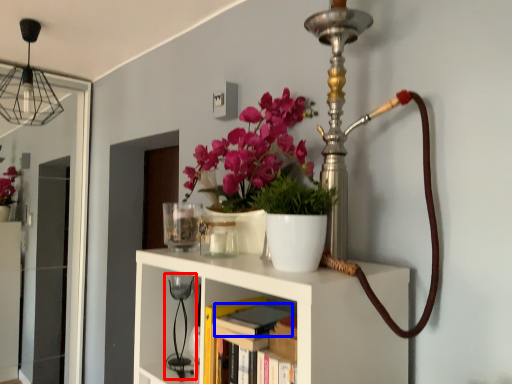
Question: Which point is closer to the camera, table lamp (highlighted by a red box) or book (highlighted by a blue box)?

Choices:
 (A) table lamp
 (B) book

Answer: (B)